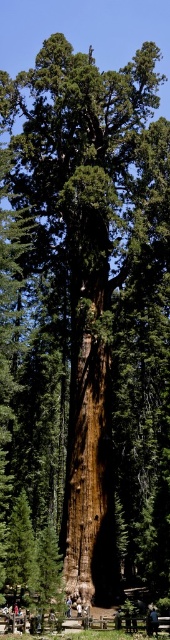
You are standing in front of the massive sequoia tree and see the dark brown leather jacket at center. Where exactly is the dark brown leather jacket located in relation to the tree?

The dark brown leather jacket at center is located at the coordinates point (x=117, y=618) in the image.